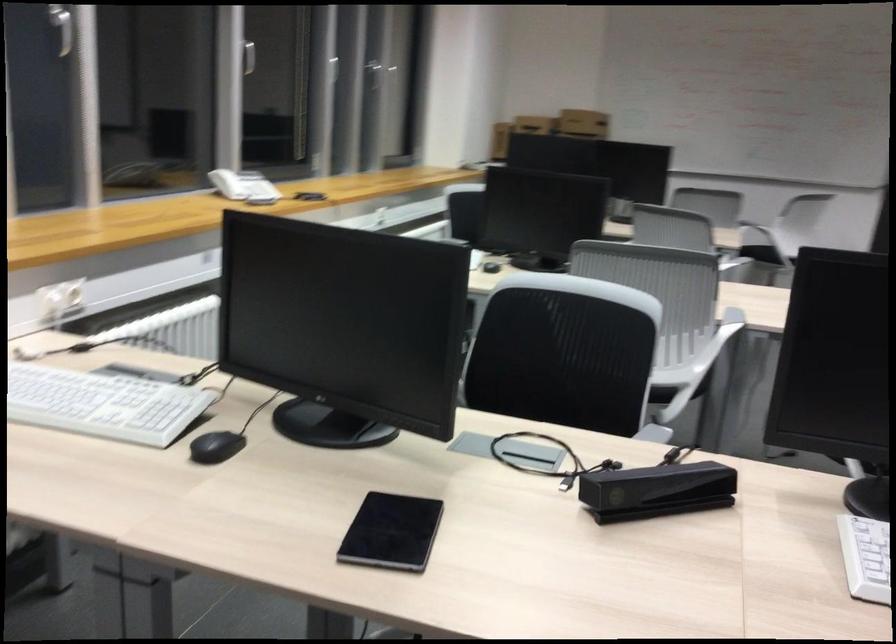
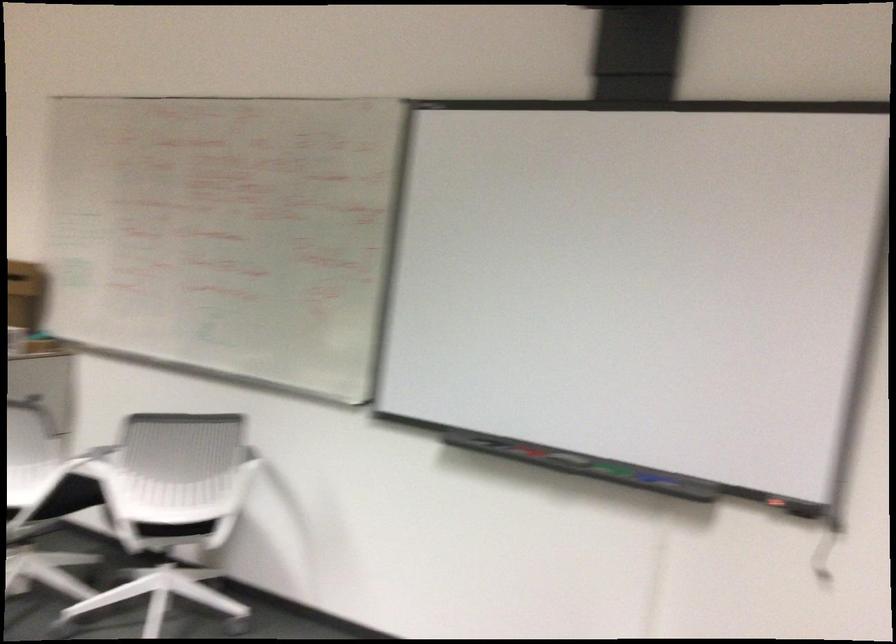
Find the pixel in the second image that matches pixel 772 216 in the first image.

(95, 460)